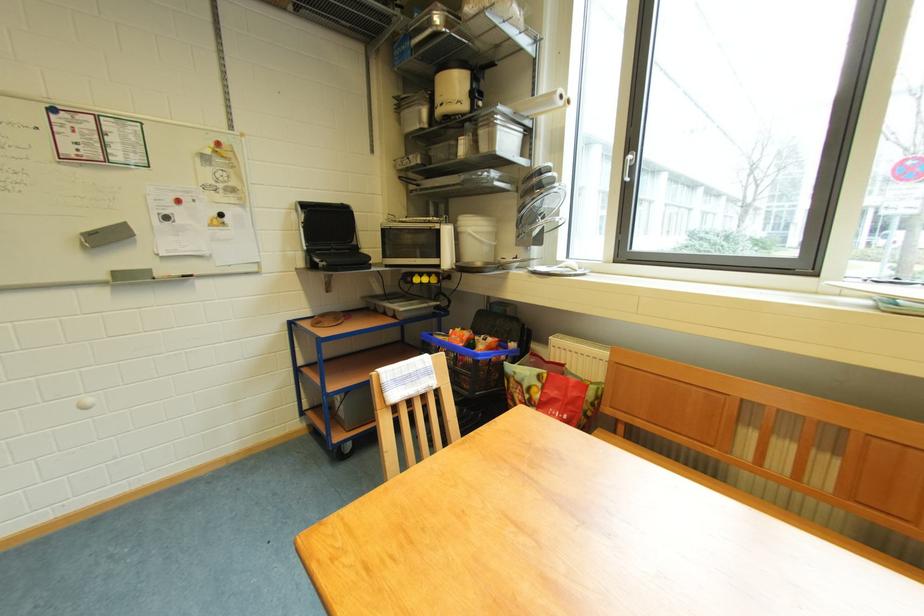
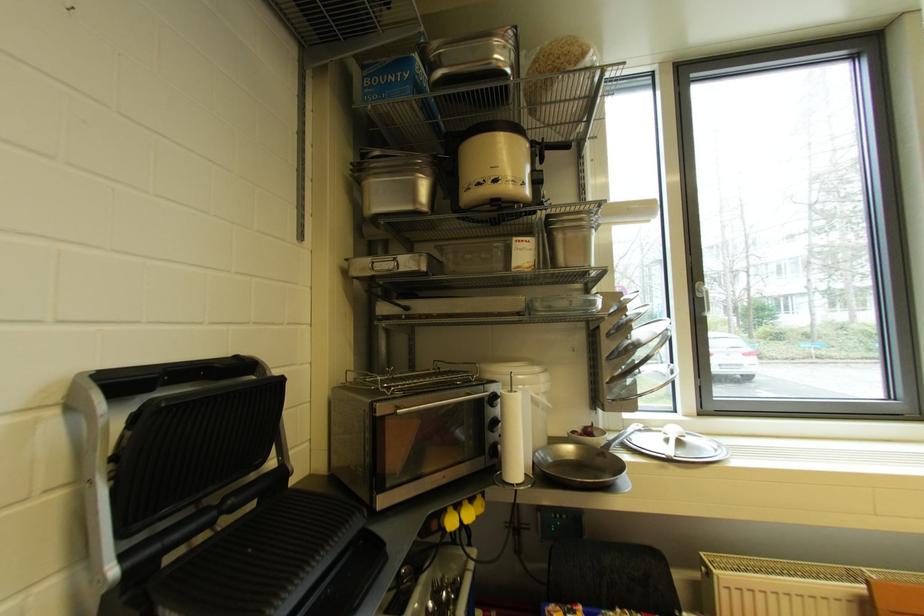
Locate, in the second image, the point that corresponds to point 412,164 in the first image.

(392, 269)